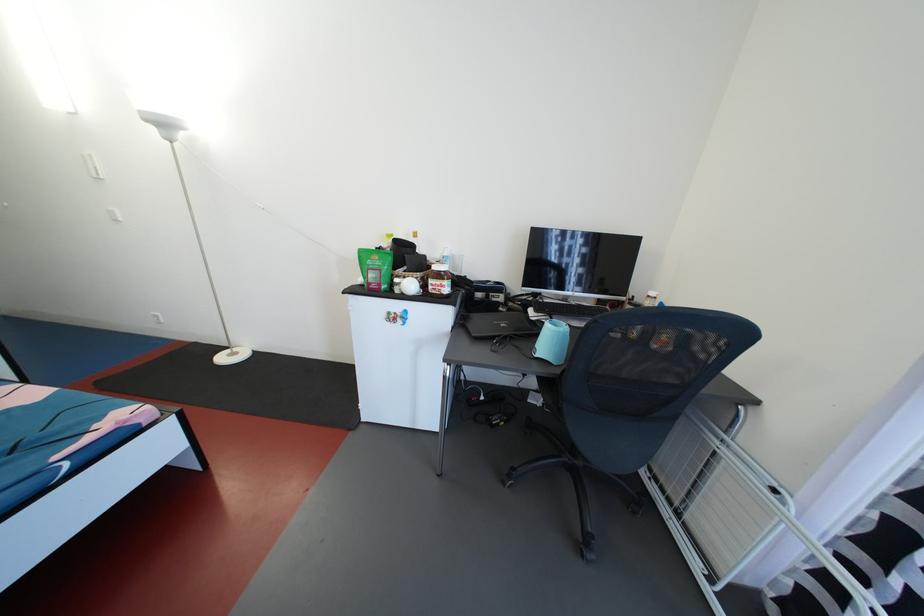
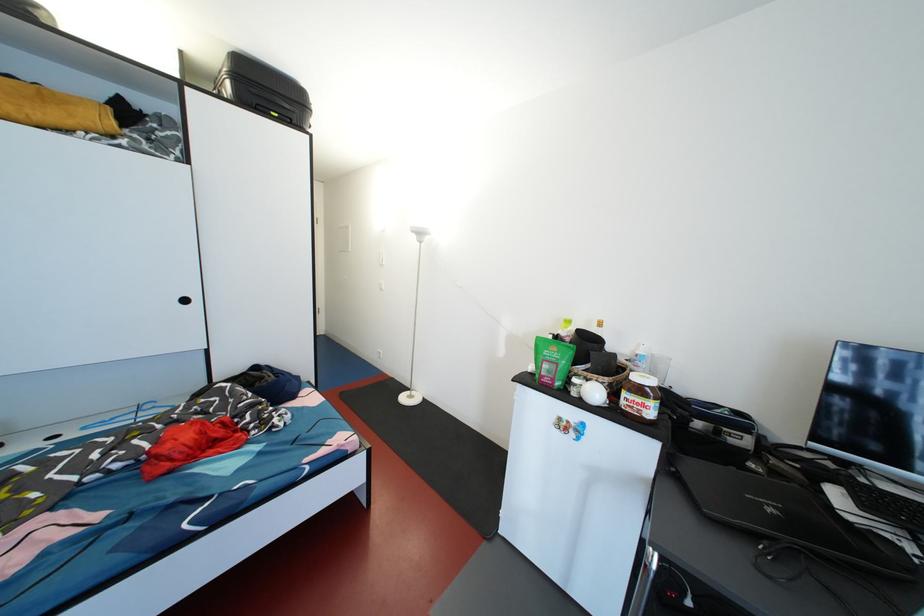
Find the pixel in the second image that matches point 369,291 in the first image.

(539, 379)